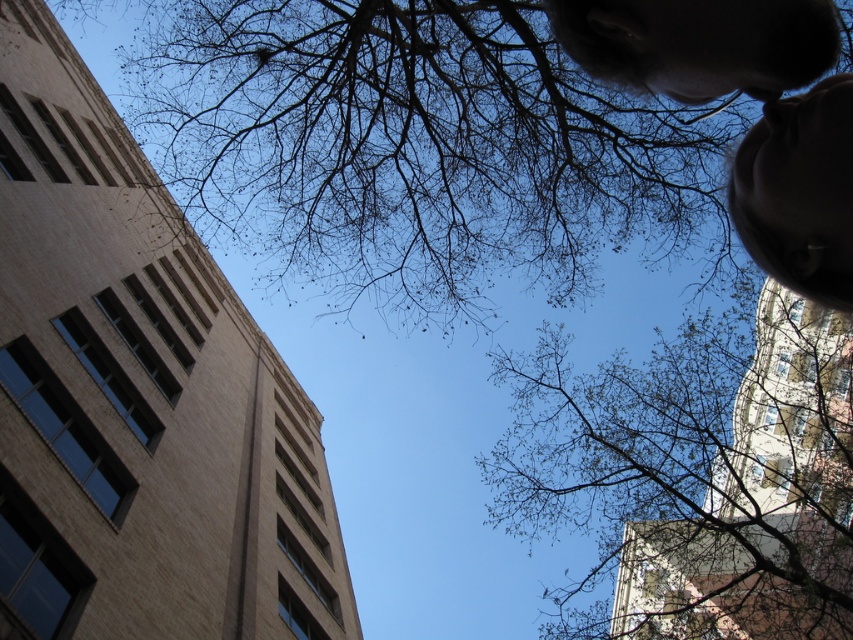
You are standing at the base of the tree with brown leafless branches at upper center. If you want to place a ladder to reach the branches for pruning, how many rungs should the ladder have if each rung is spaced 30 cm apart?

The brown leafless branches at upper center are 19.83 meters away from the viewer. Since the ladder must reach this height, the number of rungs needed would be approximately 66 rungs, as 19.83 meters divided by 0.3 meters per rung equals 66.1, so rounding up to 67 rungs for safety.

You are standing under the tree with the bare branches at upper center and looking up at the beige brick building at left. Which object is closer to you?

The bare branches at upper center are closer to you because the beige brick building at left is positioned over them, indicating it is further away.

You are standing below the tree branches and looking up. There is a point marked at coordinates (419, 148). What object is located at that point?

The point at (419, 148) has brown leafless branches at upper center.